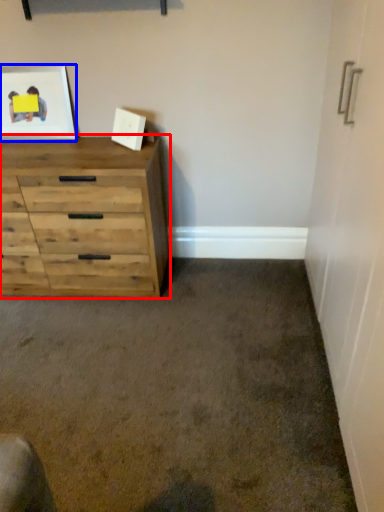
Question: Which point is closer to the camera, chest of drawers (highlighted by a red box) or picture frame (highlighted by a blue box)?

Choices:
 (A) chest of drawers
 (B) picture frame

Answer: (A)